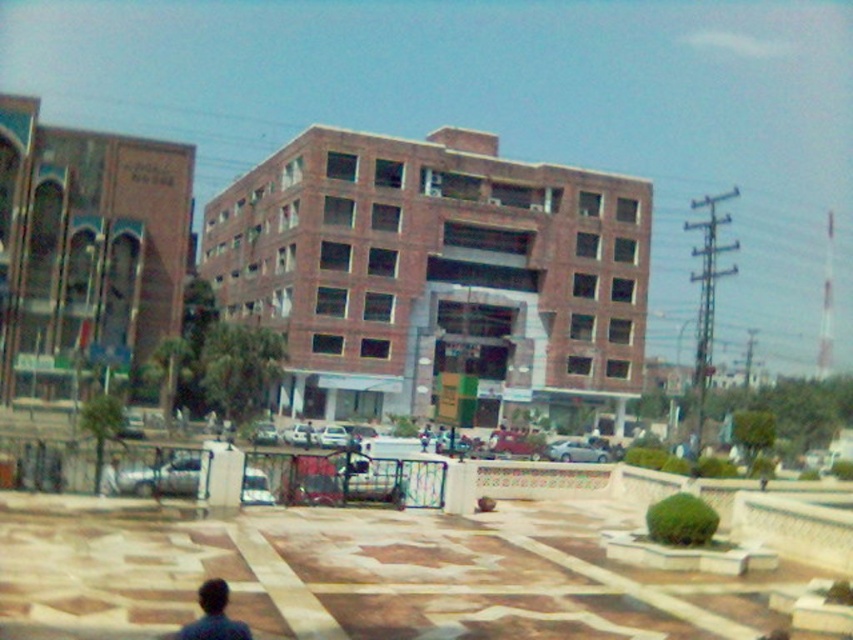
You are a city planner assessing the space in front of the brick building at center and the dark blue fabric at lower left. Which object occupies more horizontal space in the image?

The brick building at center has a greater width than the dark blue fabric at lower left, so it occupies more horizontal space.

You are standing at the center of the plaza in front of the brick building. You see a point marked at coordinates point (434, 275). Based on the scene, where is this point located?

The point (434, 275) is on the brick building at center.

From the picture: You are a city planner evaluating the space in front of the brick building at center and dark blue fabric at lower left. Which object takes up more space in the scene?

The brick building at center is larger in size than the dark blue fabric at lower left, so it takes up more space in the scene.